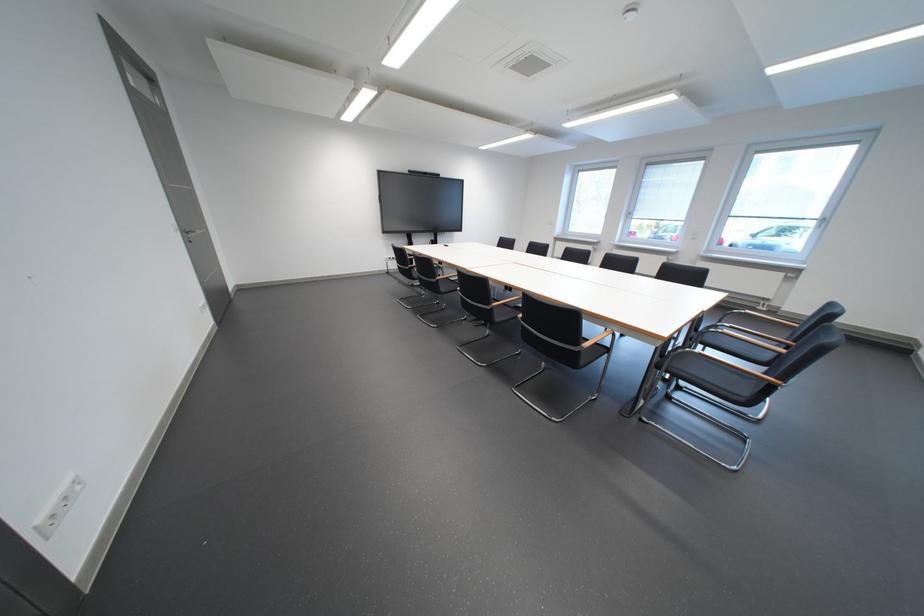
Describe the element at coordinates (58, 507) in the screenshot. I see `a white wall socket` at that location.